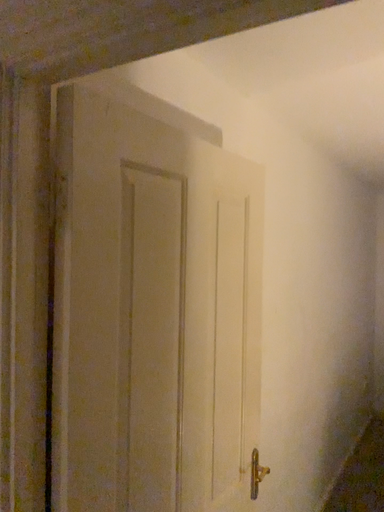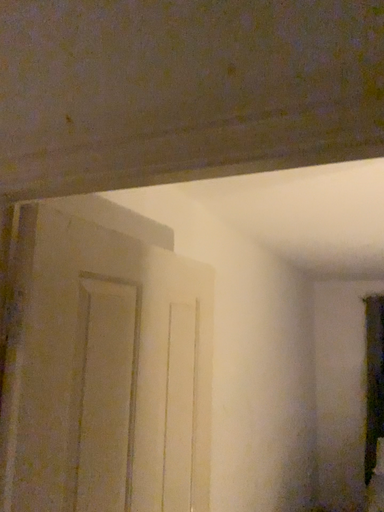
Question: How did the camera likely rotate when shooting the video?

Choices:
 (A) rotated upward
 (B) rotated downward

Answer: (A)